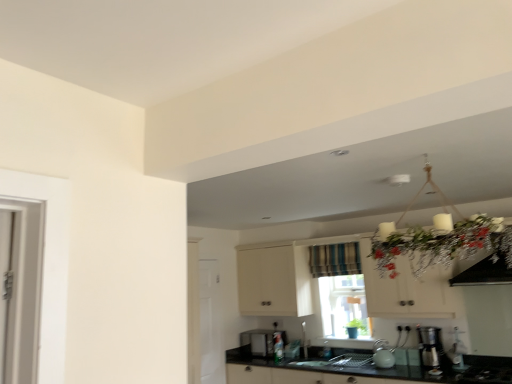
Question: Is black glass gas stove at lower right at the left side of white matte cabinet at upper center?

Choices:
 (A) no
 (B) yes

Answer: (A)

Question: Can you see black glass gas stove at lower right touching white matte cabinet at upper center?

Choices:
 (A) yes
 (B) no

Answer: (B)

Question: Does black glass gas stove at lower right have a greater height compared to white matte cabinet at upper center?

Choices:
 (A) yes
 (B) no

Answer: (B)

Question: Does black glass gas stove at lower right have a lesser height compared to white matte cabinet at upper center?

Choices:
 (A) no
 (B) yes

Answer: (B)

Question: From the image's perspective, is black glass gas stove at lower right above white matte cabinet at upper center?

Choices:
 (A) yes
 (B) no

Answer: (B)

Question: Is satin black microwave at lower center, which is the 1th appliance from back to front, inside or outside of white glossy door at lower left?

Choices:
 (A) outside
 (B) inside

Answer: (A)

Question: From a real-world perspective, is satin black microwave at lower center, which is counted as the second appliance, starting from the front, physically located above or below white glossy door at lower left?

Choices:
 (A) below
 (B) above

Answer: (A)

Question: Considering the positions of point (245, 337) and point (205, 375), is point (245, 337) closer or farther from the camera than point (205, 375)?

Choices:
 (A) closer
 (B) farther

Answer: (B)

Question: Looking at their shapes, would you say satin black microwave at lower center, the second appliance from the right, is wider or thinner than white glossy door at lower left?

Choices:
 (A) wide
 (B) thin

Answer: (A)

Question: From a real-world perspective, is clear glass window at center positioned above or below white matte cabinet at upper center?

Choices:
 (A) below
 (B) above

Answer: (A)

Question: Considering their positions, is clear glass window at center located in front of or behind white matte cabinet at upper center?

Choices:
 (A) behind
 (B) front

Answer: (A)

Question: Does point (328, 309) appear closer or farther from the camera than point (260, 249)?

Choices:
 (A) farther
 (B) closer

Answer: (B)

Question: Looking at the image, does clear glass window at center seem bigger or smaller compared to white matte cabinet at upper center?

Choices:
 (A) small
 (B) big

Answer: (A)

Question: Considering the positions of white glossy door at lower left and satin silver coffee machine at lower right in the image, is white glossy door at lower left wider or thinner than satin silver coffee machine at lower right?

Choices:
 (A) wide
 (B) thin

Answer: (B)

Question: Looking at the image, does white glossy door at lower left seem bigger or smaller compared to satin silver coffee machine at lower right?

Choices:
 (A) big
 (B) small

Answer: (A)